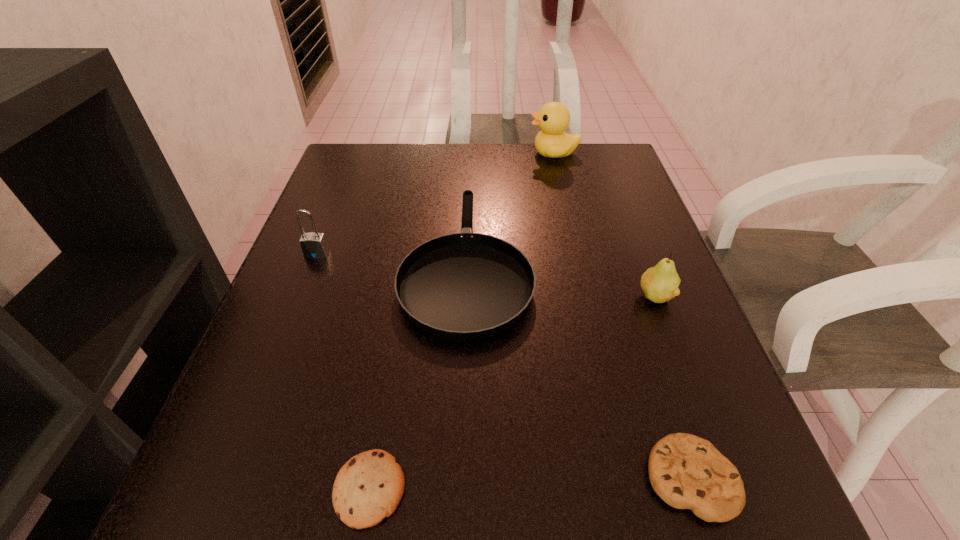
I want to click on free location located 0.320m on the face of the farthest object, so click(409, 153).

Locate an element on the screen. The height and width of the screenshot is (540, 960). free space located on the face of the farthest object is located at coordinates (435, 153).

At what (x,y) coordinates should I click in order to perform the action: click on vacant region located 0.090m on the shackle of the padlock. Please return your answer as a coordinate pair (x, y). Looking at the image, I should click on (302, 292).

You are a GUI agent. You are given a task and a screenshot of the screen. Output one action in this format:
    pyautogui.click(x=<x>, y=<y>)
    Task: Click on the vacant space located 0.070m on the left of the pear
    
    Given the screenshot: What is the action you would take?
    pyautogui.click(x=599, y=296)

At what (x,y) coordinates should I click in order to perform the action: click on free region located 0.250m on the handle side of the third shortest object. Please return your answer as a coordinate pair (x, y). The height and width of the screenshot is (540, 960). Looking at the image, I should click on (470, 149).

Where is `vacant region located 0.250m on the handle side of the third shortest object`? This screenshot has height=540, width=960. vacant region located 0.250m on the handle side of the third shortest object is located at coordinates (470, 149).

This screenshot has height=540, width=960. I want to click on vacant region located 0.210m on the handle side of the third shortest object, so click(x=469, y=157).

Where is `vacant space situated on the left of the taller cookie`? Image resolution: width=960 pixels, height=540 pixels. vacant space situated on the left of the taller cookie is located at coordinates (458, 478).

Locate an element on the screen. The width and height of the screenshot is (960, 540). free space located on the right of the shorter cookie is located at coordinates (497, 489).

This screenshot has height=540, width=960. I want to click on object located in the far edge section of the desktop, so click(553, 118).